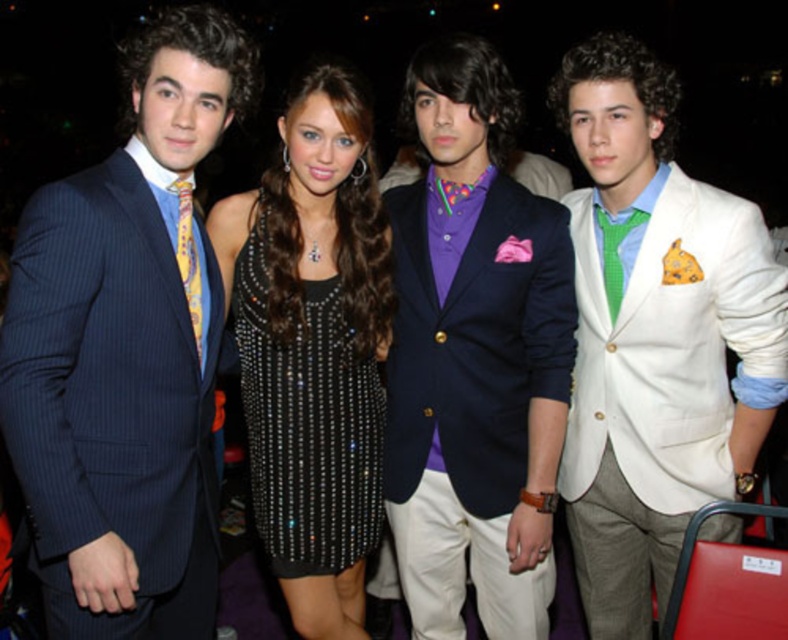
Does white textured blazer at center appear under green checkered tie at right?

Yes.

Who is higher up, white textured blazer at center or green checkered tie at right?

green checkered tie at right

Find the location of a particular element. The height and width of the screenshot is (640, 788). white textured blazer at center is located at coordinates (656, 339).

Image resolution: width=788 pixels, height=640 pixels. In order to click on white textured blazer at center in this screenshot , I will do click(x=656, y=339).

Is point (238, 333) more distant than point (188, 260)?

Yes, point (238, 333) is farther from viewer.

Between black sequined dress at center and yellowstriped fabrictie at left, which one appears on the left side from the viewer's perspective?

From the viewer's perspective, yellowstriped fabrictie at left appears more on the left side.

At what (x,y) coordinates should I click in order to perform the action: click on black sequined dress at center. Please return your answer as a coordinate pair (x, y). Looking at the image, I should click on (307, 419).

What do you see at coordinates (307, 419) in the screenshot? The image size is (788, 640). I see `black sequined dress at center` at bounding box center [307, 419].

How much distance is there between black sequined dress at center and green checkered tie at right?

A distance of 36.01 inches exists between black sequined dress at center and green checkered tie at right.

Between point (268, 484) and point (641, 216), which one is positioned behind?

The point (268, 484) is behind.

Find the location of `black sequined dress at center`. black sequined dress at center is located at coordinates (307, 419).